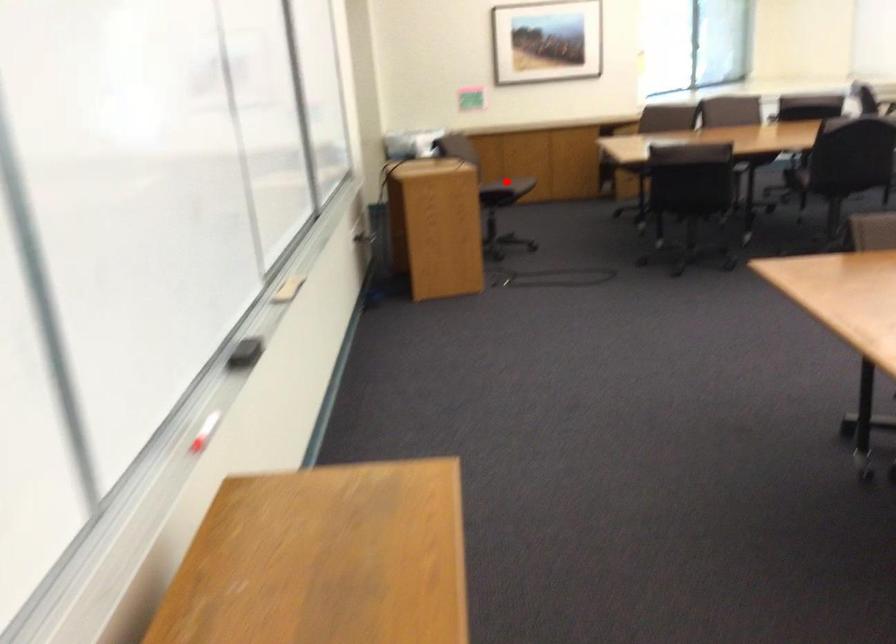
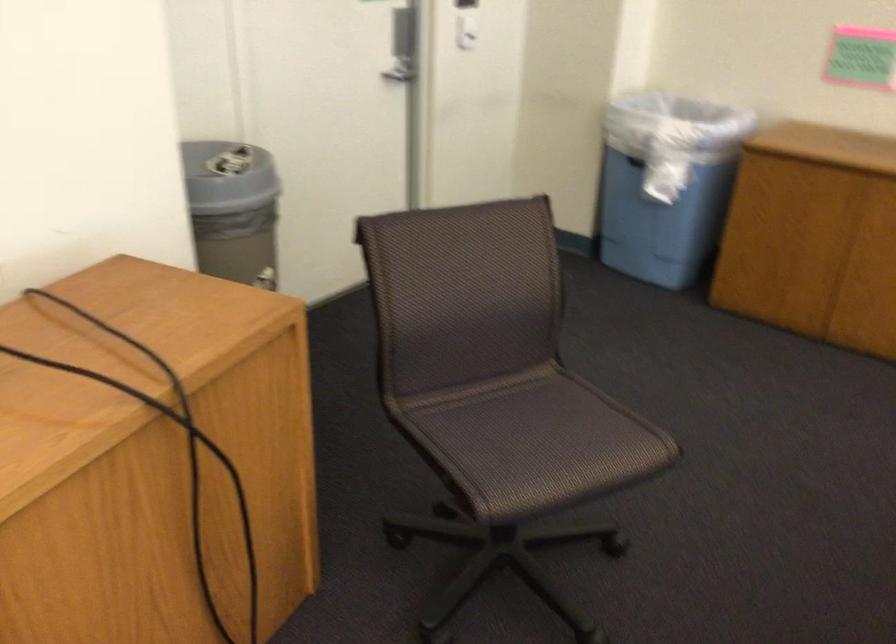
Question: I am providing you with two images of the same scene from different viewpoints. A red point is marked on the first image. At the location where the point appears in image 1, is it still visible in image 2?

Choices:
 (A) Yes
 (B) No

Answer: (B)